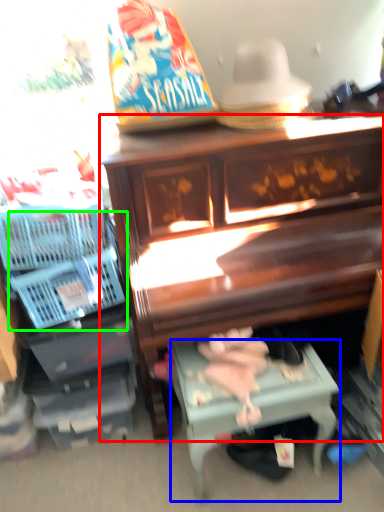
Question: Which is farther away from furniture (highlighted by a red box)? table (highlighted by a blue box) or basket (highlighted by a green box)?

Choices:
 (A) table
 (B) basket

Answer: (B)